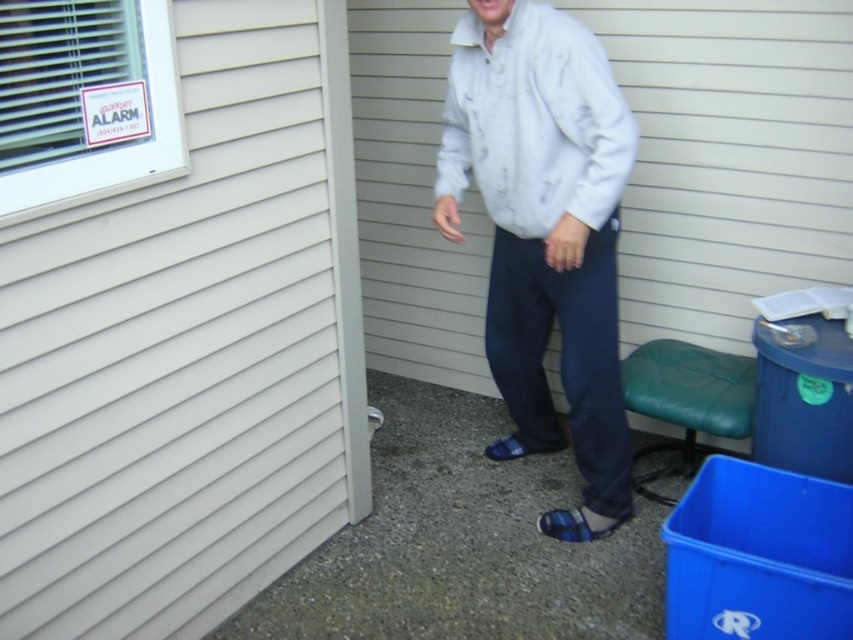
Does point (363, 147) lie behind point (560, 24)?

Yes, point (363, 147) is farther from viewer.

Find the location of a particular element. This screenshot has height=640, width=853. white siding at center is located at coordinates (728, 157).

You are a GUI agent. You are given a task and a screenshot of the screen. Output one action in this format:
    pyautogui.click(x=<x>, y=<y>)
    Task: Click on the white siding at center
    This screenshot has width=853, height=640.
    Given the screenshot: What is the action you would take?
    pyautogui.click(x=728, y=157)

Which of these two, white siding at upper left or white siding at center, stands shorter?

white siding at center

In the scene shown: Can you confirm if white siding at upper left is smaller than white siding at center?

No.

Where is `white siding at upper left`? white siding at upper left is located at coordinates (178, 321).

Identify the location of white siding at upper left. Image resolution: width=853 pixels, height=640 pixels. (178, 321).

Is white siding at center thinner than blue plaid sandal at lower center?

No, white siding at center is not thinner than blue plaid sandal at lower center.

Is white siding at center smaller than blue plaid sandal at lower center?

No.

Where is `white siding at center`? white siding at center is located at coordinates pyautogui.click(x=728, y=157).